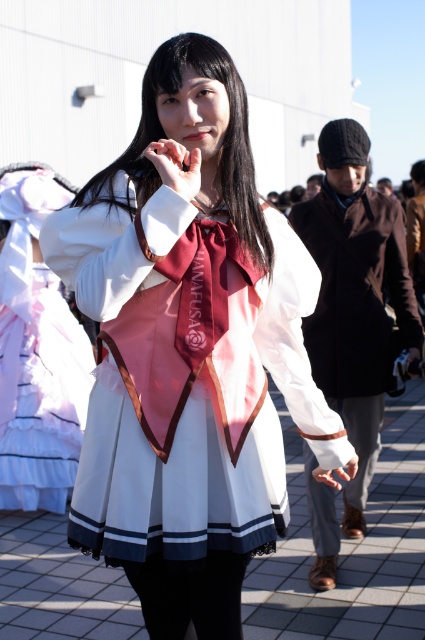
Question: Can you confirm if white satin dress at center is bigger than matte white dress at center?

Choices:
 (A) no
 (B) yes

Answer: (A)

Question: Considering the relative positions of black velvet coat at right and maroon satin tie at center in the image provided, where is black velvet coat at right located with respect to maroon satin tie at center?

Choices:
 (A) below
 (B) above

Answer: (A)

Question: Which point appears farthest from the camera in this image?

Choices:
 (A) (263, 234)
 (B) (68, 336)

Answer: (B)

Question: Which of these objects is positioned closest to the black velvet coat at right?

Choices:
 (A) black tights at lower center
 (B) matte white dress at center
 (C) white satin dress at center

Answer: (C)

Question: Among these points, which one is farthest from the camera?

Choices:
 (A) 348,198
 (B) 176,248
 (C) 204,588

Answer: (A)

Question: Is maroon satin tie at center wider than leather brown wristband at lower right?

Choices:
 (A) no
 (B) yes

Answer: (A)